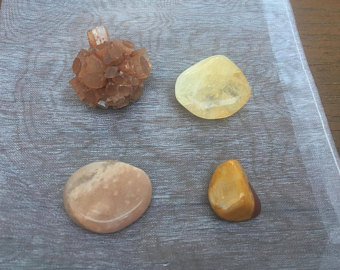
What are the coordinates of `wooden tabletop` in the screenshot? It's located at (325, 38).